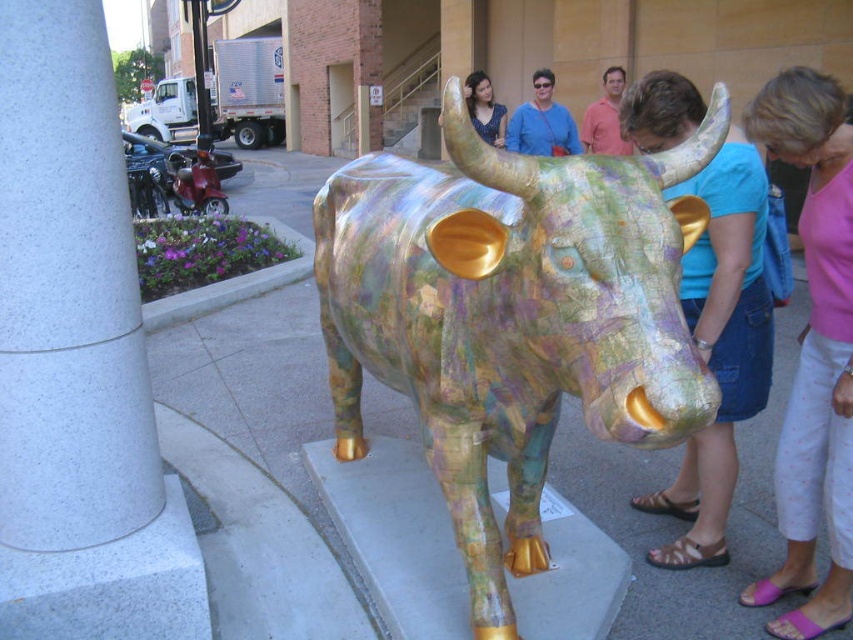
Who is higher up, pink fabric pants at lower right or blue fabric purse at center?

blue fabric purse at center

Is pink fabric pants at lower right to the left of blue fabric purse at center from the viewer's perspective?

Incorrect, pink fabric pants at lower right is not on the left side of blue fabric purse at center.

Does point (744, 122) lie behind point (579, 148)?

No, (744, 122) is closer to viewer.

Find the location of a particular element. This screenshot has width=853, height=640. pink fabric pants at lower right is located at coordinates (813, 353).

Is point (758, 161) positioned before point (531, 108)?

That is True.

Which is behind, point (761, 365) or point (532, 129)?

Positioned behind is point (532, 129).

Is point (635, 145) farther from viewer compared to point (526, 104)?

No.

The image size is (853, 640). Identify the location of blue denim shorts at center. (720, 348).

Does point (788, 524) come closer to viewer compared to point (730, 209)?

No, it is behind (730, 209).

Is the position of pink fabric pants at lower right more distant than that of blue denim shorts at center?

That is False.

Who is more forward, (833, 332) or (701, 480)?

Positioned in front is point (833, 332).

Where is `pink fabric pants at lower right`? The image size is (853, 640). pink fabric pants at lower right is located at coordinates (813, 353).